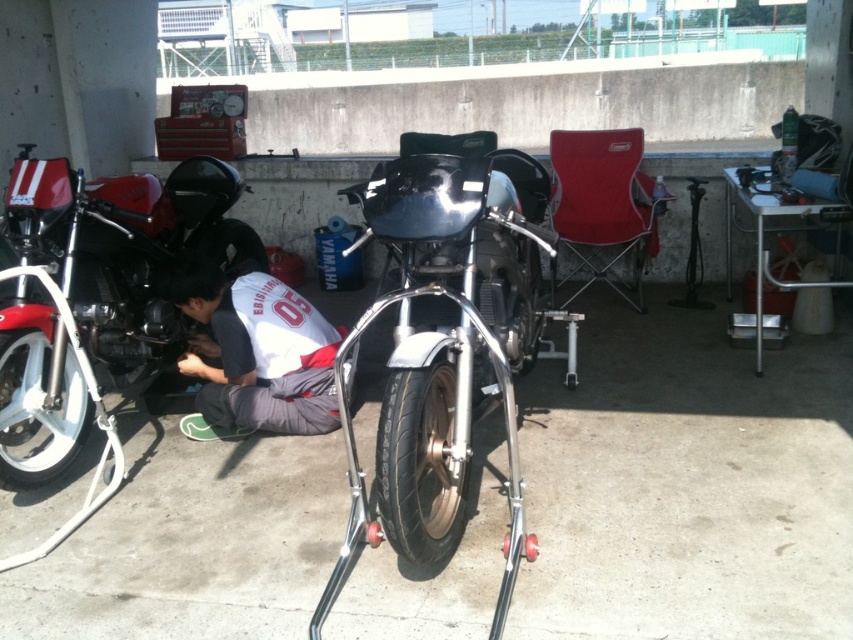
You are a delivery person with a cart that is 1.5 meters wide. You need to navigate between the shiny chrome motorcycle at center and the shiny red motorcycle at left to reach the delivery point behind them. Can your cart fit through the space between them?

The shiny chrome motorcycle at center and shiny red motorcycle at left are 1.39 meters apart from each other. Since your cart is 1.5 meters wide, it cannot fit through the space between them as the gap is narrower than the cart.

You are a photographer trying to capture the white fabric shirt at lower center and the white rubber tire at lower left in the same frame. Which object should you position closer to the left side of your camera viewfinder to include both in the shot?

The white rubber tire at lower left should be positioned closer to the left side of the camera viewfinder since the white fabric shirt at lower center is to the right of it.